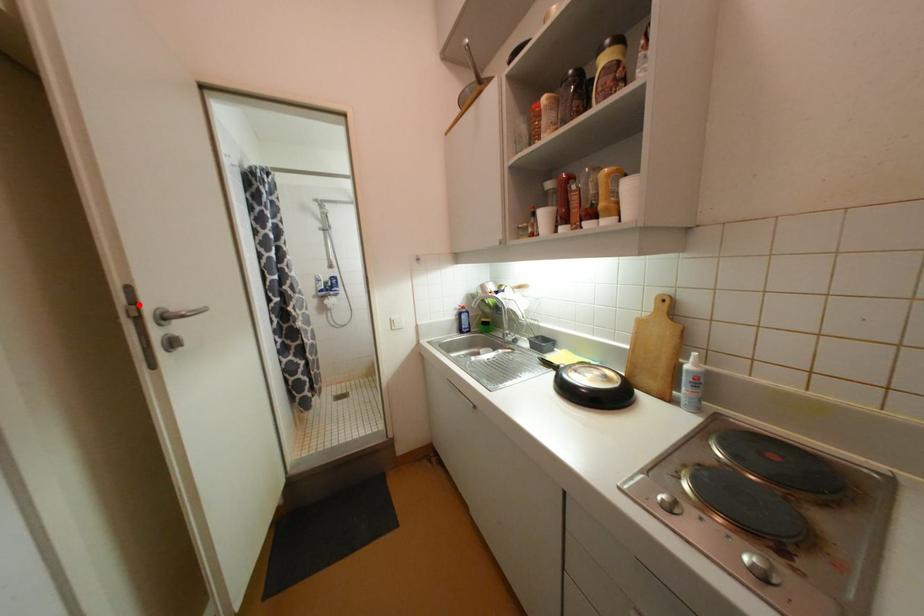
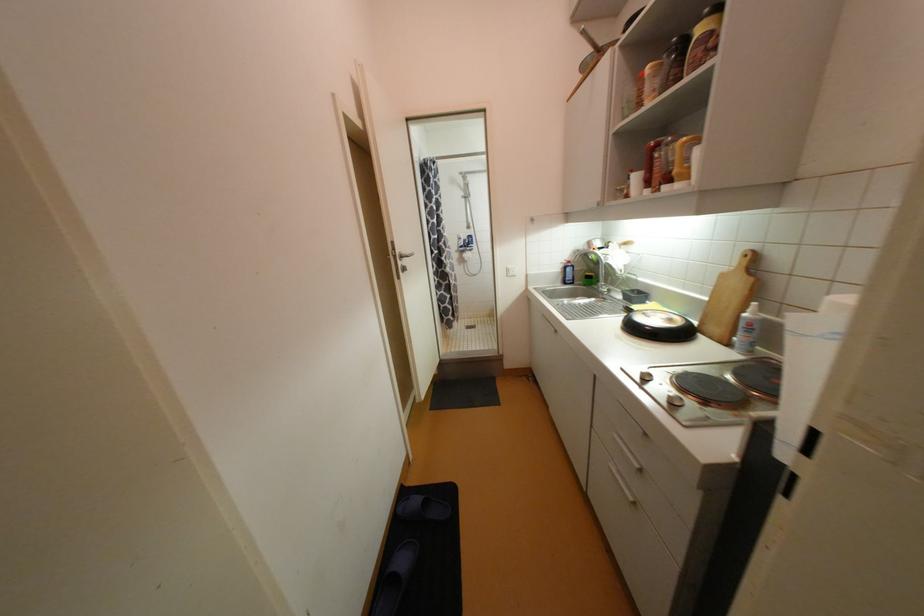
The point at the highlighted location is marked in the first image. Where is the corresponding point in the second image?

(398, 251)